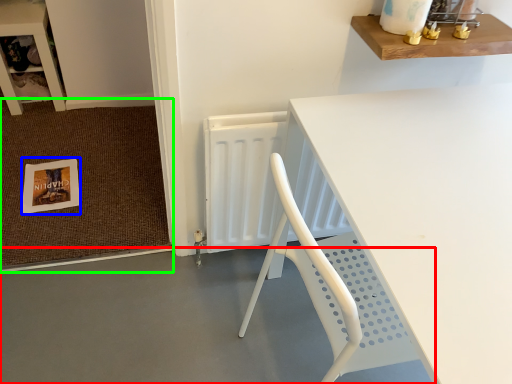
Question: Based on their relative distances, which object is nearer to concrete (highlighted by a red box)? Choose from postcard (highlighted by a blue box) and doormat (highlighted by a green box).

Choices:
 (A) postcard
 (B) doormat

Answer: (B)